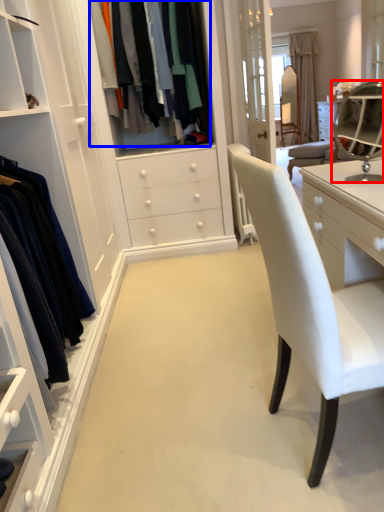
Question: Which object is closer to the camera taking this photo, mirror (highlighted by a red box) or clothing (highlighted by a blue box)?

Choices:
 (A) mirror
 (B) clothing

Answer: (A)